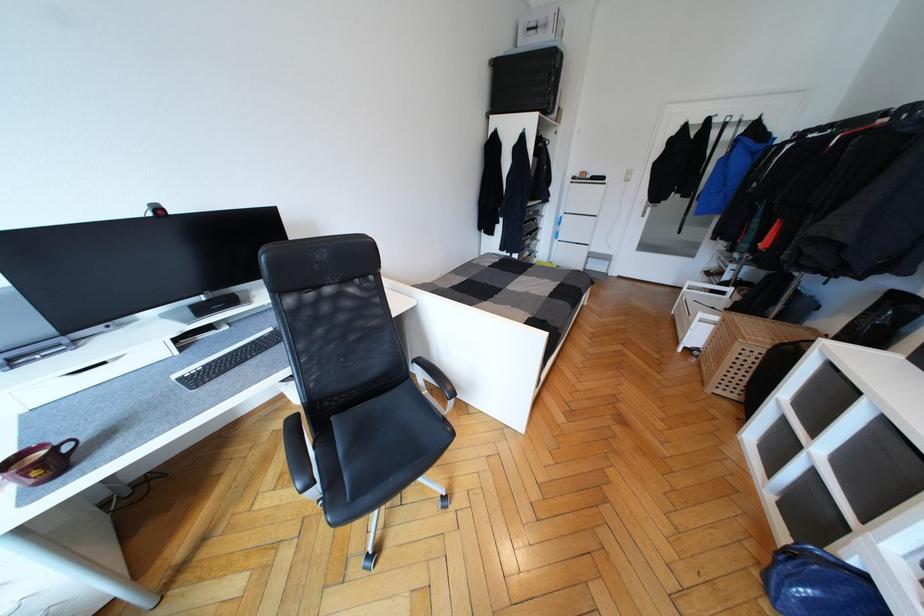
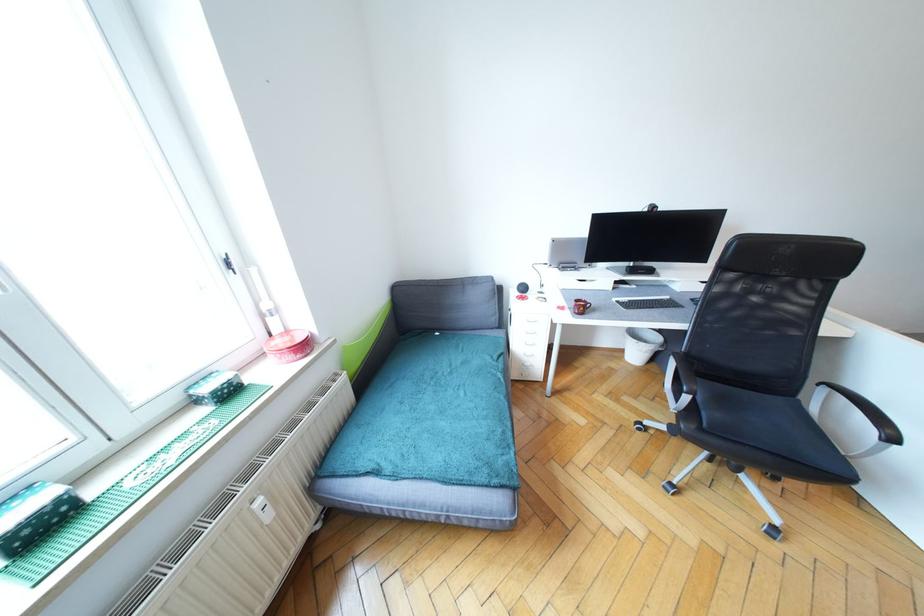
In the second image, find the point that corresponds to (45,448) in the first image.

(589, 302)